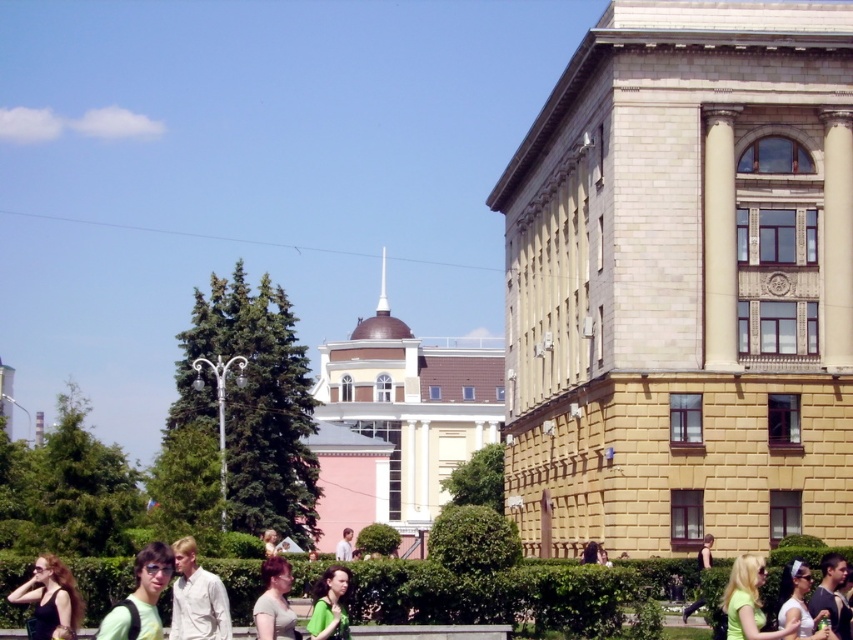
Is green leafy hedge at center shorter than light beige shirt at lower left?

No.

Does point (492, 544) lie in front of point (212, 582)?

No, (492, 544) is further to viewer.

The height and width of the screenshot is (640, 853). In order to click on green leafy hedge at center in this screenshot , I will do `click(473, 540)`.

Does matte black dress at lower left appear over green fabric shirt at center?

Yes, matte black dress at lower left is above green fabric shirt at center.

Describe the element at coordinates (51, 596) in the screenshot. The height and width of the screenshot is (640, 853). I see `matte black dress at lower left` at that location.

Where is `matte black dress at lower left`? The height and width of the screenshot is (640, 853). matte black dress at lower left is located at coordinates (51, 596).

Can you confirm if light beige shirt at lower left is smaller than light brown hair at center?

Yes.

Who is more forward, (177, 582) or (274, 614)?

Point (274, 614)

You are a GUI agent. You are given a task and a screenshot of the screen. Output one action in this format:
    pyautogui.click(x=<x>, y=<y>)
    Task: Click on the light beige shirt at lower left
    
    Given the screenshot: What is the action you would take?
    pyautogui.click(x=196, y=598)